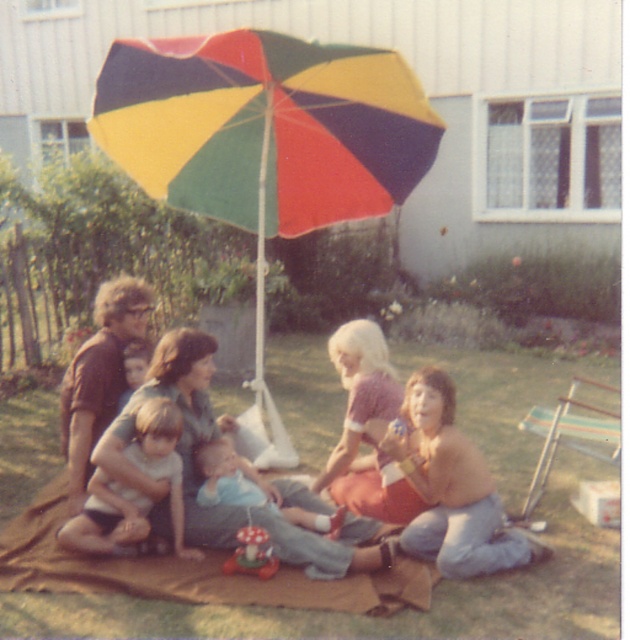
Question: Which of the following is the closest to the observer?

Choices:
 (A) (227, 124)
 (B) (89, 465)

Answer: (B)

Question: Estimate the real-world distances between objects in this image. Which object is closer to the multicolored fabric umbrella at center?

Choices:
 (A) brown fabric shirt at left
 (B) light brown fabric shorts at lower left

Answer: (A)

Question: Does matte gray shirt at center have a larger size compared to light brown fabric shorts at lower left?

Choices:
 (A) yes
 (B) no

Answer: (A)

Question: Among these points, which one is farthest from the camera?

Choices:
 (A) (185, 340)
 (B) (72, 486)

Answer: (B)

Question: Does matte gray shirt at center appear under light brown fabric shorts at lower left?

Choices:
 (A) yes
 (B) no

Answer: (B)

Question: Can you confirm if multicolored fabric umbrella at center is positioned above light brown fabric shorts at lower left?

Choices:
 (A) no
 (B) yes

Answer: (B)